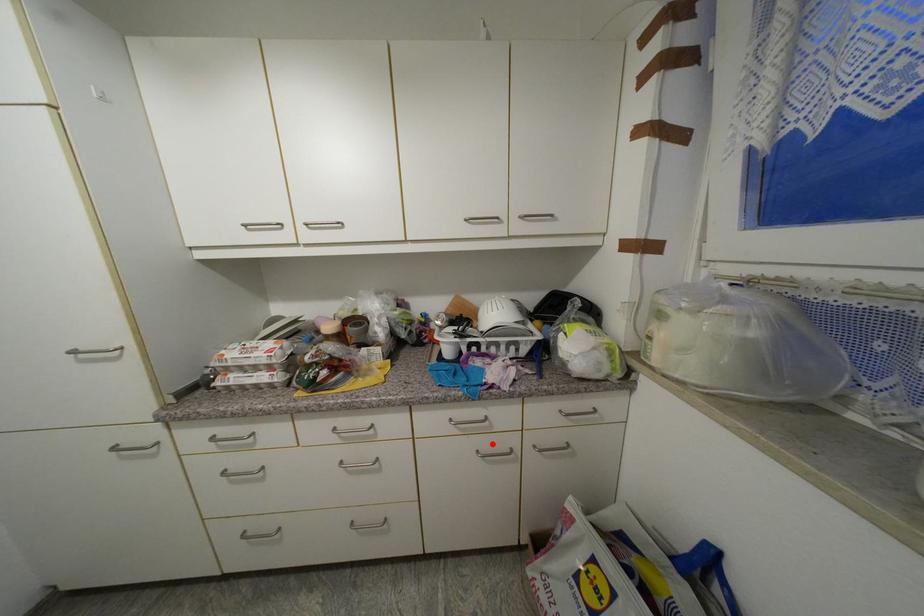
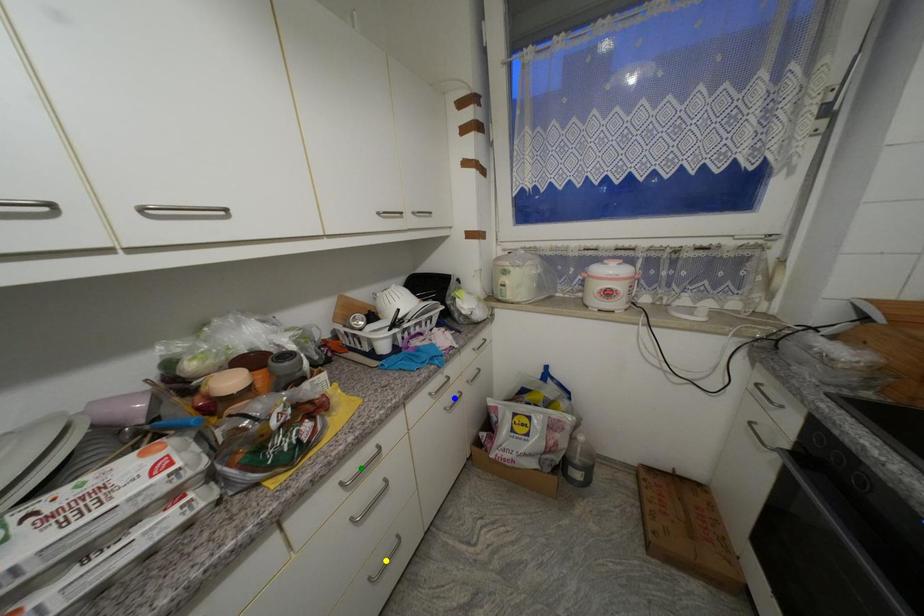
Question: I am providing you with two images of the same scene from different viewpoints. A red point is marked on the first image. You are given multiple points on the second image. Can you choose the point in image 2 that corresponds to the point in image 1?

Choices:
 (A) yellow point
 (B) blue point
 (C) green point

Answer: (B)